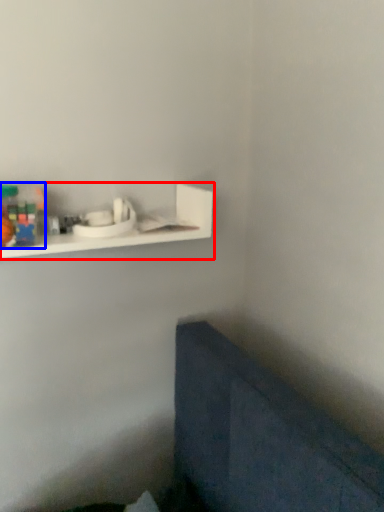
Question: Which of the following is the closest to the observer, shelf (highlighted by a red box) or toy (highlighted by a blue box)?

Choices:
 (A) shelf
 (B) toy

Answer: (B)